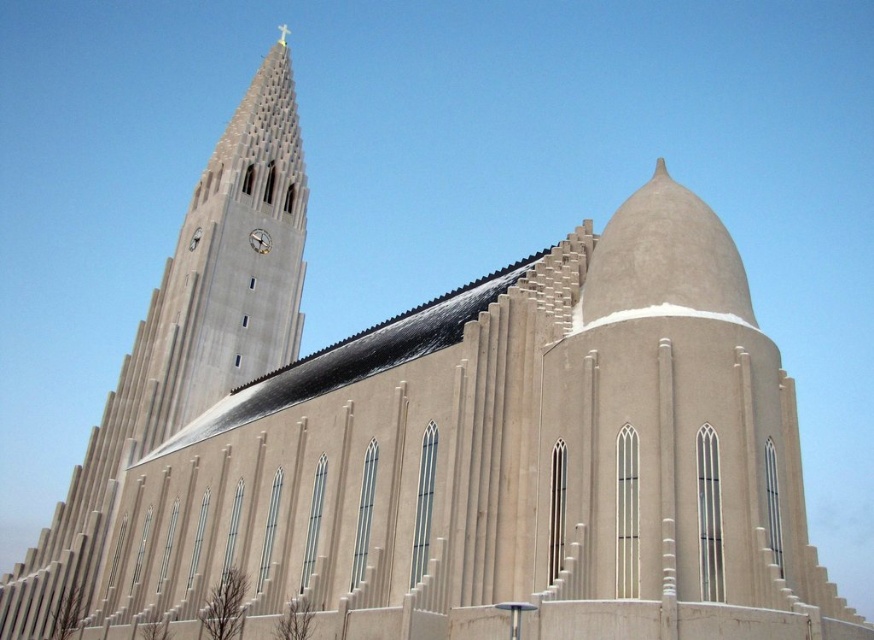
Question: Does smooth concrete tower at upper left have a greater width compared to metallic clock face at upper center?

Choices:
 (A) no
 (B) yes

Answer: (B)

Question: Can you confirm if smooth concrete tower at upper left is positioned to the left of metallic clock face at upper center?

Choices:
 (A) no
 (B) yes

Answer: (B)

Question: Which of the following is the farthest from the observer?

Choices:
 (A) smooth concrete tower at upper left
 (B) metallic clock face at upper center

Answer: (B)

Question: Does smooth concrete tower at upper left come behind metallic clock face at upper center?

Choices:
 (A) no
 (B) yes

Answer: (A)